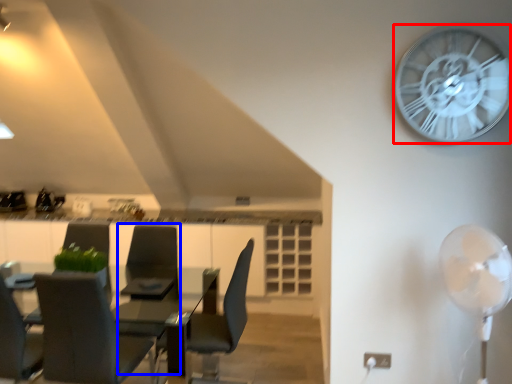
Question: Which point is further to the camera, wall clock (highlighted by a red box) or armchair (highlighted by a blue box)?

Choices:
 (A) wall clock
 (B) armchair

Answer: (B)